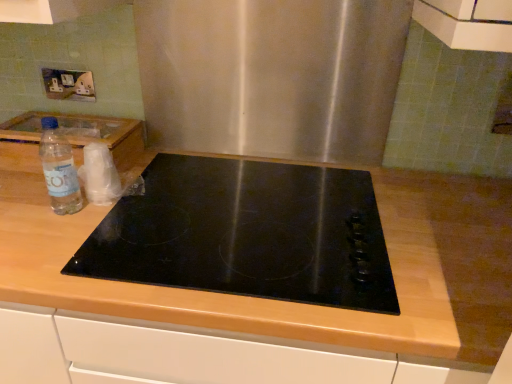
Locate an element on the screen. The image size is (512, 384). vacant area located to the right-hand side of clear plastic bottle at left is located at coordinates (140, 208).